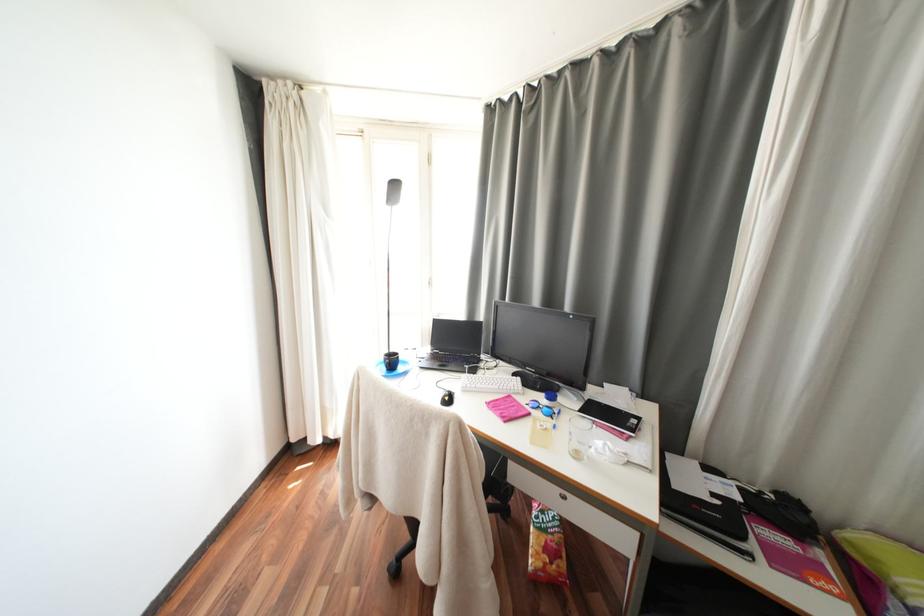
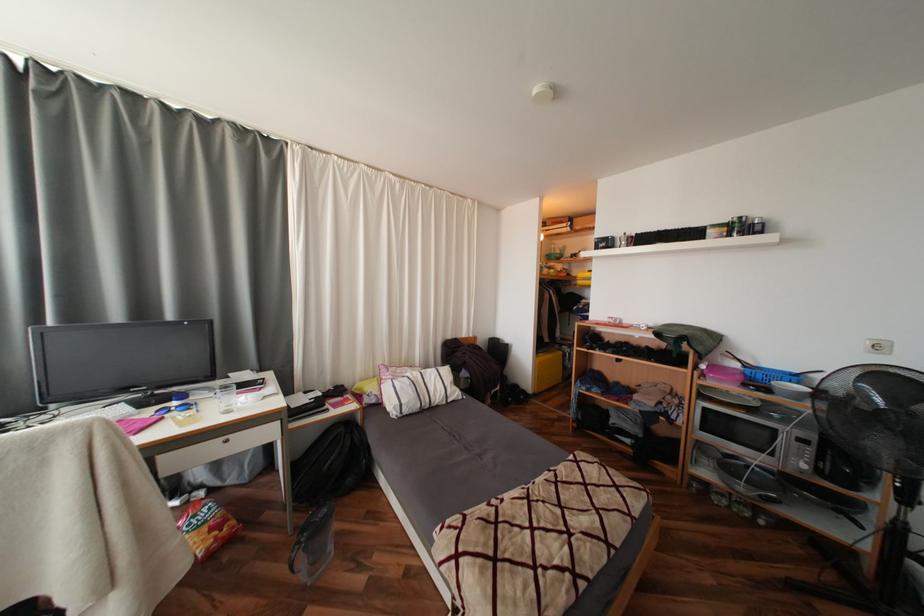
Question: The camera is either moving clockwise (left) or counter-clockwise (right) around the object. The first image is from the beginning of the video and the second image is from the end. Is the camera moving left or right when shooting the video?

Choices:
 (A) Left
 (B) Right

Answer: (A)